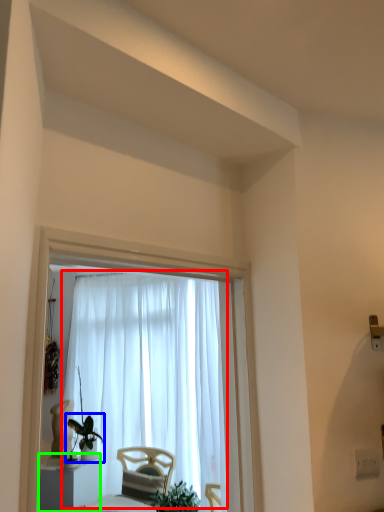
Question: Which is farther away from curtain (highlighted by a red box)? houseplant (highlighted by a blue box) or furniture (highlighted by a green box)?

Choices:
 (A) houseplant
 (B) furniture

Answer: (B)